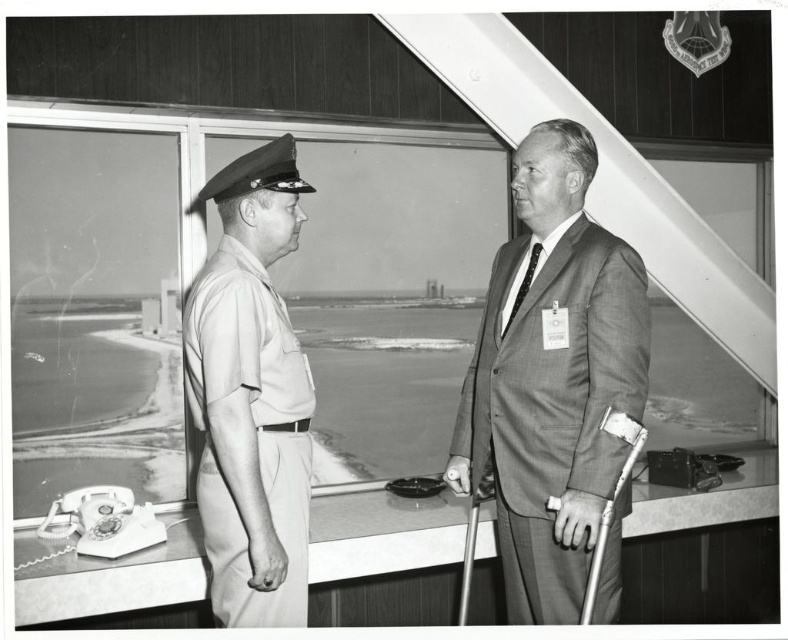
Does gray suit at center have a lesser width compared to khaki uniform at left?

In fact, gray suit at center might be wider than khaki uniform at left.

This screenshot has height=640, width=788. What do you see at coordinates (552, 378) in the screenshot? I see `gray suit at center` at bounding box center [552, 378].

What are the coordinates of `gray suit at center` in the screenshot? It's located at tap(552, 378).